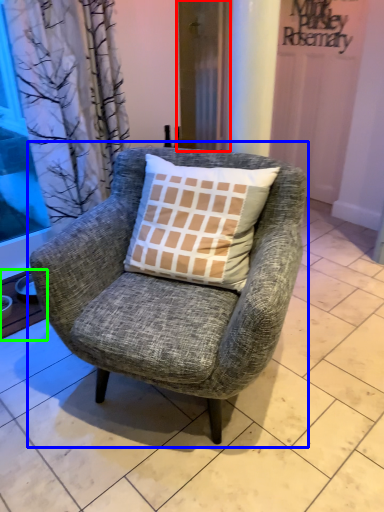
Question: Which is farther away from screen door (highlighted by a red box)? chair (highlighted by a blue box) or window sill (highlighted by a green box)?

Choices:
 (A) chair
 (B) window sill

Answer: (B)